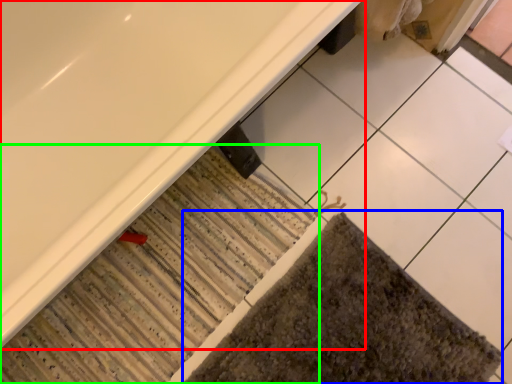
Question: Which object is positioned farthest from bathtub (highlighted by a red box)? Select from bath mat (highlighted by a blue box) and bath mat (highlighted by a green box).

Choices:
 (A) bath mat
 (B) bath mat

Answer: (A)